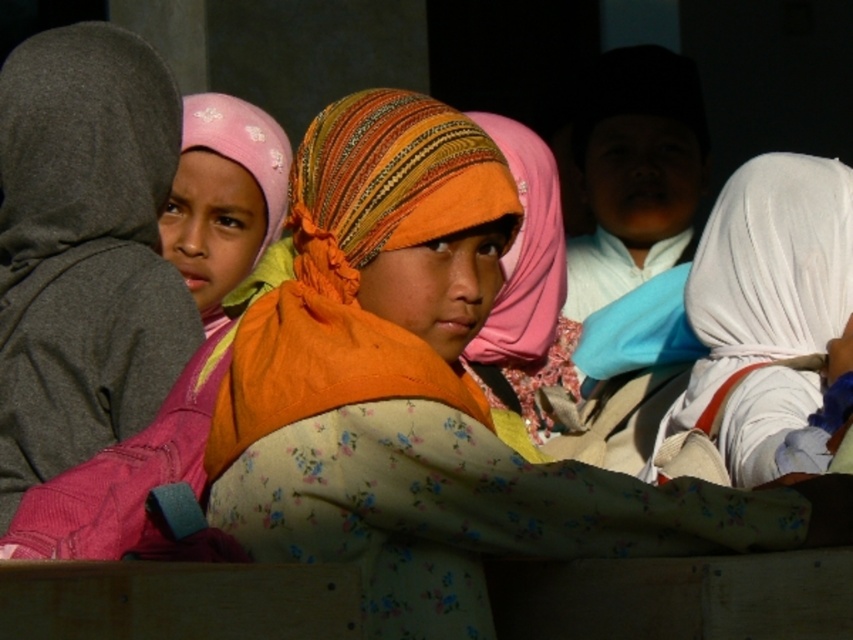
You are a photographer trying to capture a closeup of the child with the orange headscarf. You have two focus points available at coordinates point [360,346] and point [173,429]. Which focus point should you use to ensure the orange headscarf child is in focus?

Point [360,346] is closer to the viewer than point [173,429], so you should use point [360,346] to focus on the child with the orange headscarf.

You are a photographer trying to capture a clear shot of the orange fabric headscarf at center and the orange woven headscarf at center. Which one is closer to the camera?

The orange fabric headscarf at center is in front of the orange woven headscarf at center, so it is closer to the camera.